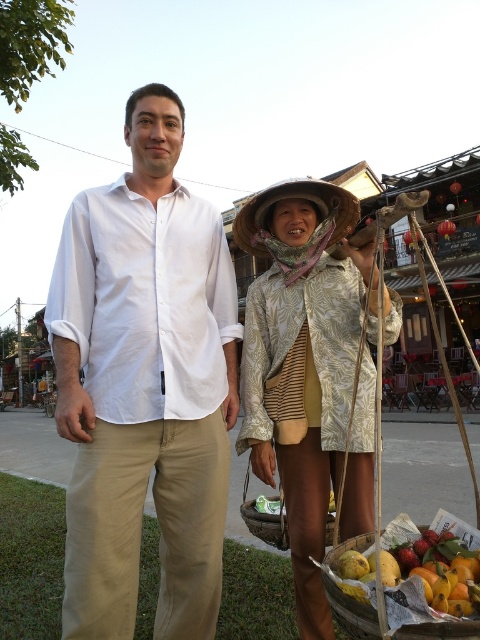
You are a photographer trying to capture both the white linen shirt at center and the printed fabric hat at center in the same frame. The minimum distance your camera can focus on two objects is 20 inches. Can you fit both subjects into your camera frame without moving closer?

The distance between the white linen shirt at center and the printed fabric hat at center is 20.79 inches. Since this exceeds the camera minimum focus distance of 20 inches, you can fit both subjects into the frame without moving closer.

You are standing in the scene and need to locate the white linen shirt at center. Based on the coordinates provided, where would you look relative to the center of the image?

The white linen shirt at center is located at coordinates point (144,385), which means it is positioned to the right and slightly below the center of the image.